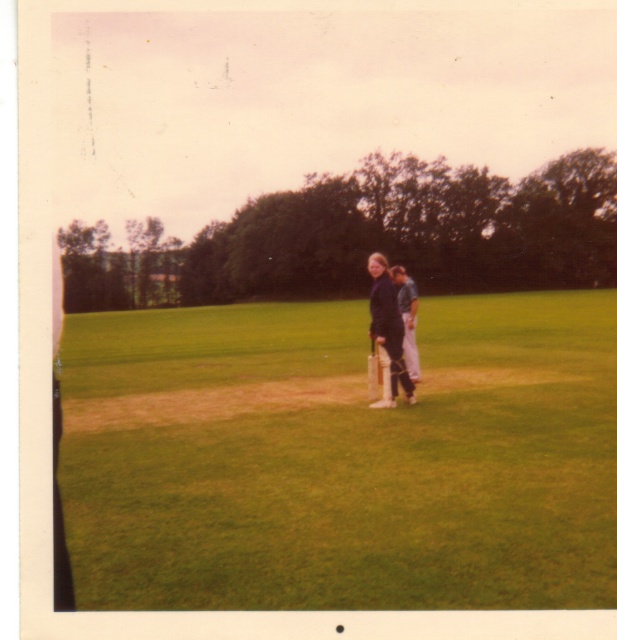
Question: In this image, where is dark blue fabric jacket at center located relative to wooden baseball bat at center?

Choices:
 (A) below
 (B) above

Answer: (B)

Question: Which is nearer to the dark blue fabric jacket at center?

Choices:
 (A) wooden baseball bat at center
 (B) dark blue fabric shirt at center
 (C) green grass at center

Answer: (A)

Question: In this image, where is dark blue fabric jacket at center located relative to wooden baseball bat at center?

Choices:
 (A) above
 (B) below

Answer: (A)

Question: Is dark blue fabric shirt at center to the right of wooden baseball bat at center from the viewer's perspective?

Choices:
 (A) no
 (B) yes

Answer: (B)

Question: Which object is positioned closest to the dark blue fabric shirt at center?

Choices:
 (A) dark blue fabric jacket at center
 (B) green grass at center

Answer: (A)

Question: Which of these objects is positioned closest to the dark blue fabric shirt at center?

Choices:
 (A) wooden baseball bat at center
 (B) dark blue fabric jacket at center
 (C) green grass at center

Answer: (B)